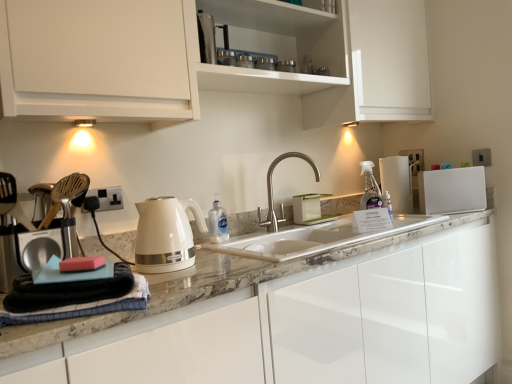
Question: From a real-world perspective, relative to white glossy cabinet at upper center, the 2th cabinetry positioned from the bottom, is glossy white cabinet at center, the 1th cabinetry in the bottom-to-top sequence, vertically above or below?

Choices:
 (A) above
 (B) below

Answer: (B)

Question: From the image's perspective, is glossy white cabinet at center, the 2th cabinetry in the top-to-bottom sequence, positioned above or below white glossy cabinet at upper center, the 2th cabinetry positioned from the bottom?

Choices:
 (A) above
 (B) below

Answer: (B)

Question: Which of these objects is positioned closest to the satin nickel faucet at center?

Choices:
 (A) white glossy electric kettle at center-left
 (B) white glossy cabinet at upper center, the 2th cabinetry positioned from the bottom
 (C) white glossy refrigerator at right
 (D) white marble sink at center
 (E) black plastic electrical outlet at left, which is the 1th electric outlet from bottom to top

Answer: (D)

Question: Estimate the real-world distances between objects in this image. Which object is farther from the white marble sink at center?

Choices:
 (A) white plastic electric outlet at upper right, the 2th electric outlet when ordered from bottom to top
 (B) white glossy refrigerator at right
 (C) satin nickel faucet at center
 (D) black plastic electrical outlet at left, the 1th electric outlet positioned from the front
 (E) white glossy cabinet at upper center, arranged as the 1th cabinetry when viewed from the top

Answer: (A)